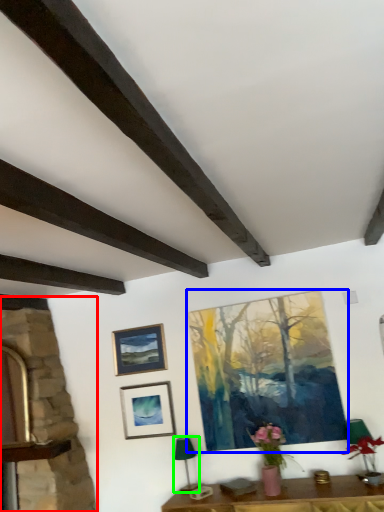
Question: Considering the real-world distances, which object is farthest from fireplace (highlighted by a red box)? picture frame (highlighted by a blue box) or lamp (highlighted by a green box)?

Choices:
 (A) picture frame
 (B) lamp

Answer: (A)